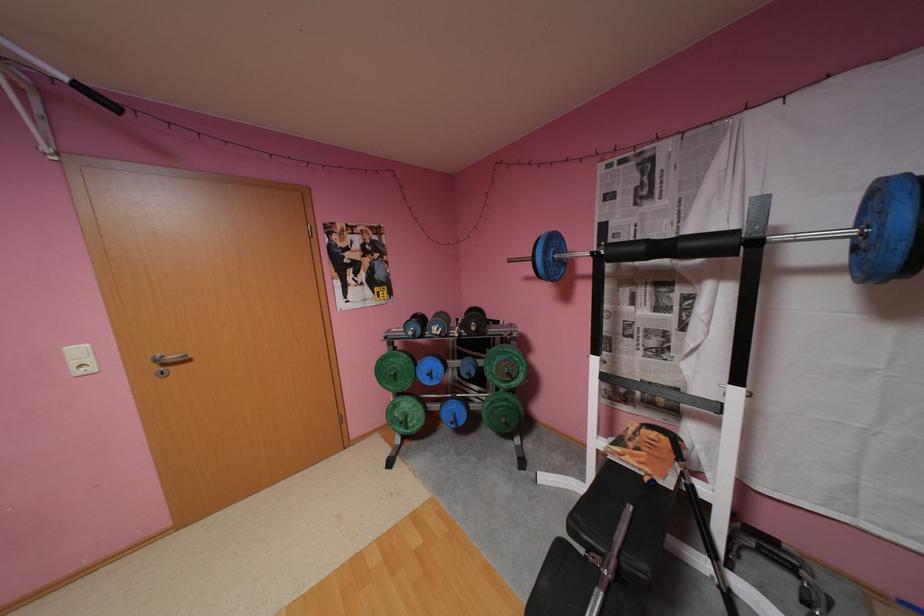
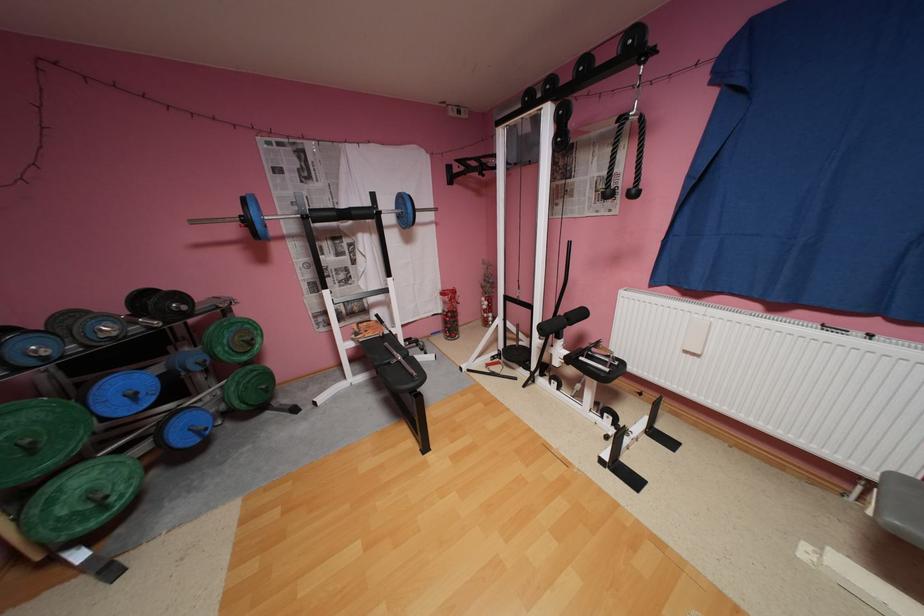
In the second image, find the point that corresponds to the point at 640,461 in the first image.

(380, 334)